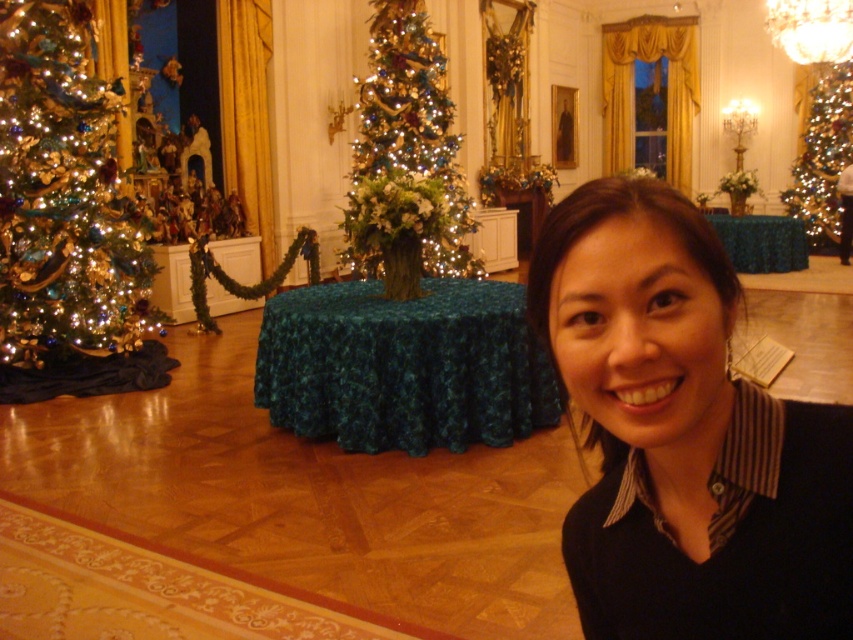
Between black striped shirt at center and iridescent glass christmas tree at center, which one has more height?

iridescent glass christmas tree at center

Does point (616, 492) lie in front of point (410, 35)?

Yes, it is.

Between point (555, 275) and point (426, 40), which one is positioned behind?

Point (426, 40)

You are a GUI agent. You are given a task and a screenshot of the screen. Output one action in this format:
    pyautogui.click(x=<x>, y=<y>)
    Task: Click on the black striped shirt at center
    
    Given the screenshot: What is the action you would take?
    pyautogui.click(x=683, y=435)

Between black striped shirt at center and shiny gold christmas tree at upper right, which one is positioned higher?

shiny gold christmas tree at upper right is above.

Between point (772, 547) and point (838, 138), which one is positioned in front?

Point (772, 547) is in front.

Locate an element on the screen. The height and width of the screenshot is (640, 853). black striped shirt at center is located at coordinates (683, 435).

Does shiny gold ornaments at left have a lesser width compared to shiny gold christmas tree at upper right?

In fact, shiny gold ornaments at left might be wider than shiny gold christmas tree at upper right.

Between shiny gold ornaments at left and shiny gold christmas tree at upper right, which one is positioned higher?

shiny gold christmas tree at upper right is higher up.

Is point (93, 253) closer to viewer compared to point (801, 189)?

Yes, it is.

Locate an element on the screen. shiny gold ornaments at left is located at coordinates (62, 193).